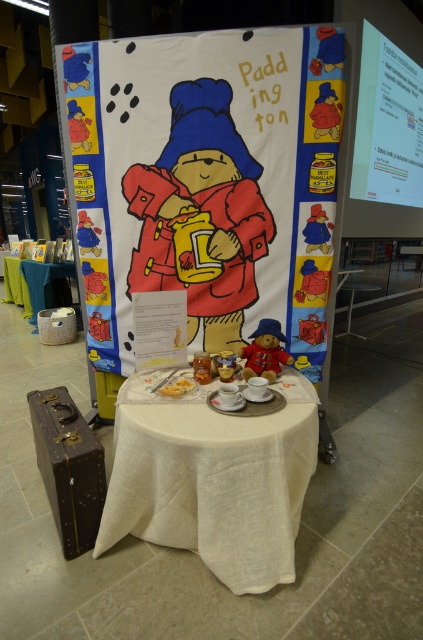
You are setting up for a tea party and need to place a 2.5 meter long tablecloth between the white linen table at center and the white fabric table at lower left. Will the tablecloth be long enough to cover both tables?

The distance between the white linen table at center and the white fabric table at lower left is 3.94 meters. Since the tablecloth is only 2.5 meters long, it will not be long enough to cover both tables as the distance exceeds the tablecloth length.

Consider the image. You are setting up a photo shoot for a childrens book. You have a matte paper paddington bear poster at center and a white linen table at center. Which object is taller?

The matte paper paddington bear poster at center is much taller than the white linen table at center.

You are setting up for a tea party and need to place a 10 cm tall teapot on the table. Can the white linen table at center support the teapot without it touching the leather suitcase at lower left?

The white linen table at center has a greater height compared to the leather suitcase at lower left, so the teapot placed on the table will not touch the suitcase as the table is taller than the suitcase.